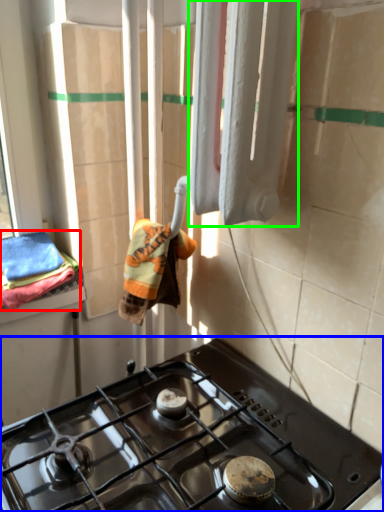
Question: Based on their relative distances, which object is farther from bath towel (highlighted by a red box)? Choose from gas stove (highlighted by a blue box) and curtain (highlighted by a green box).

Choices:
 (A) gas stove
 (B) curtain

Answer: (B)